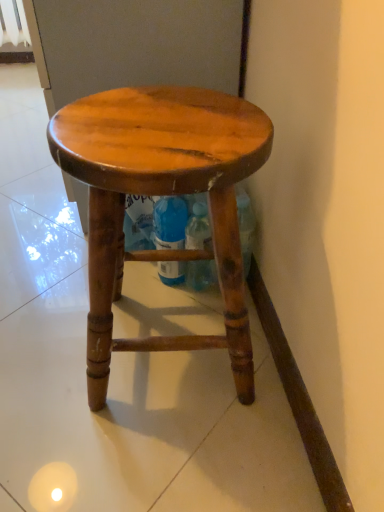
What do you see at coordinates (163, 194) in the screenshot? This screenshot has height=512, width=384. I see `wooden stool at center` at bounding box center [163, 194].

Where is `wooden stool at center`? This screenshot has width=384, height=512. wooden stool at center is located at coordinates (163, 194).

The image size is (384, 512). Find the location of `wooden stool at center`. wooden stool at center is located at coordinates (163, 194).